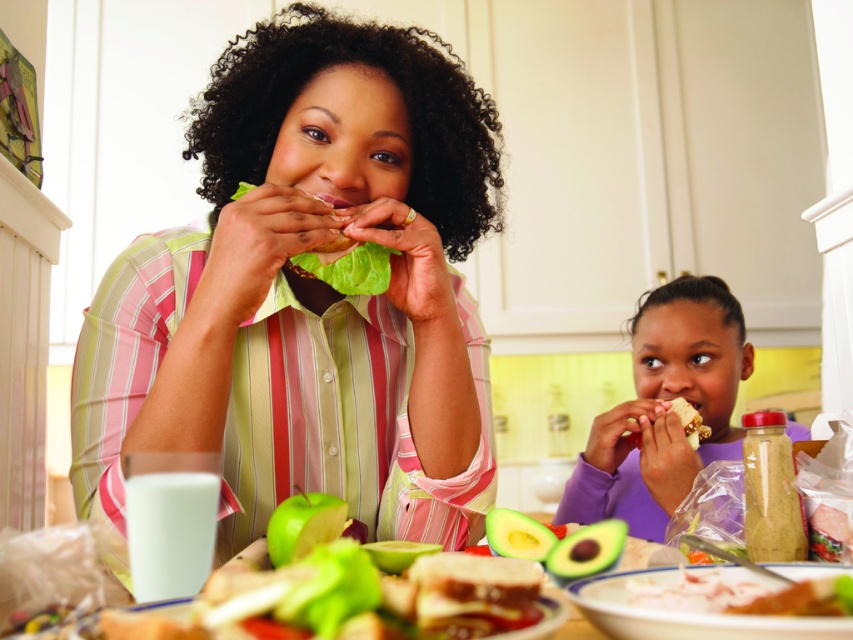
Where is `purple matte shirt at lower right`? The width and height of the screenshot is (853, 640). purple matte shirt at lower right is located at coordinates (664, 408).

Consider the image. Is purple matte shirt at lower right to the left of smooth white bread at right from the viewer's perspective?

Incorrect, purple matte shirt at lower right is not on the left side of smooth white bread at right.

Does point (714, 308) come behind point (686, 422)?

That is True.

The height and width of the screenshot is (640, 853). In order to click on purple matte shirt at lower right in this screenshot , I will do `click(664, 408)`.

Is matte green shirt at center further to camera compared to smooth white bread at right?

No.

Where is `matte green shirt at center`? matte green shirt at center is located at coordinates (309, 292).

Is matte green shirt at center positioned in front of purple matte shirt at lower right?

Yes, it is in front of purple matte shirt at lower right.

Between matte green shirt at center and purple matte shirt at lower right, which one is positioned lower?

purple matte shirt at lower right is below.

Between point (213, 451) and point (691, 326), which one is positioned behind?

The point (691, 326) is behind.

Identify the location of matte green shirt at center. (309, 292).